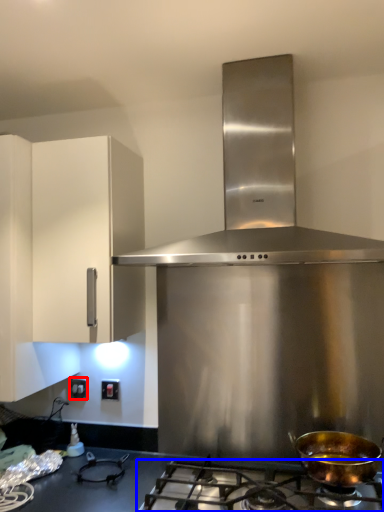
Question: Which object is further to the camera taking this photo, electric outlet (highlighted by a red box) or gas stove (highlighted by a blue box)?

Choices:
 (A) electric outlet
 (B) gas stove

Answer: (A)